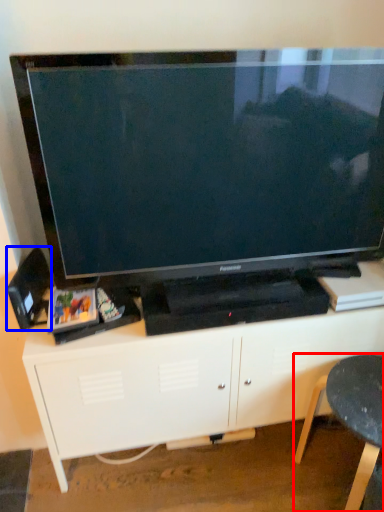
Question: Which of the following is the farthest to the observer, furniture (highlighted by a red box) or speaker (highlighted by a blue box)?

Choices:
 (A) furniture
 (B) speaker

Answer: (B)